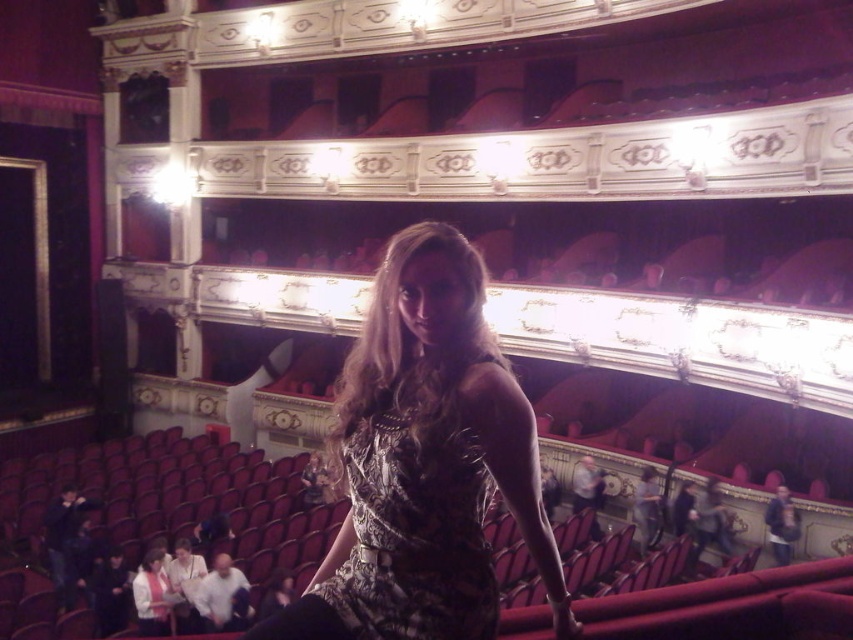
You are a photographer positioned at the back of the theater. You want to capture a photo of both the metallic dress at center and the printed fabric dress at center. Which dress should you focus on first if you want to include both in your frame without moving the camera?

The metallic dress at center is to the left of the printed fabric dress at center, so you should focus on the metallic dress at center first as it is positioned further left and closer to the edge of the frame to include both in the photo.

You are sitting in the theater and want to take a photo of the metallic dress at center. To ensure the dress is in the frame, where should you aim your camera?

The metallic dress at center is located at point (x=425, y=461), so aim your camera towards the center of the image slightly to the right and lower middle to capture it.